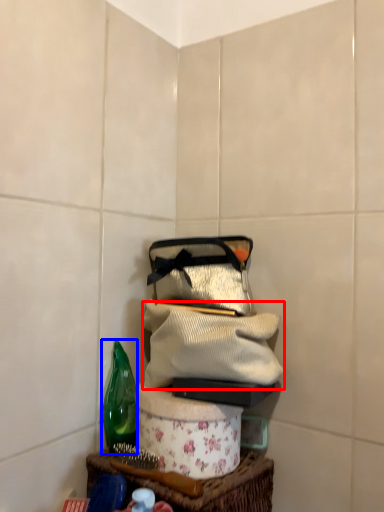
Question: Which object is closer to the camera taking this photo, clothing (highlighted by a red box) or bottle (highlighted by a blue box)?

Choices:
 (A) clothing
 (B) bottle

Answer: (A)